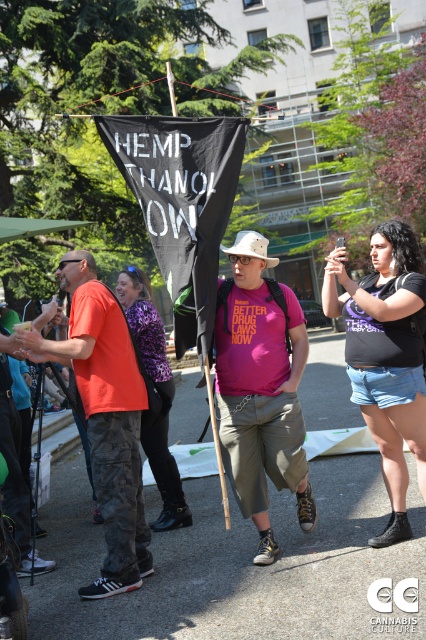
Question: Is orange t-shirt at center bigger than purple printed shirt at center?

Choices:
 (A) no
 (B) yes

Answer: (A)

Question: Which point is farther to the camera?

Choices:
 (A) (402, 381)
 (B) (264, 257)

Answer: (B)

Question: Can you confirm if pink matte t-shirt at center is positioned to the left of purple printed shirt at center?

Choices:
 (A) yes
 (B) no

Answer: (B)

Question: Is matte black t-shirt at center above purple printed shirt at center?

Choices:
 (A) yes
 (B) no

Answer: (A)

Question: Which object is the closest to the matte black t-shirt at center?

Choices:
 (A) pink matte t-shirt at center
 (B) purple printed shirt at center

Answer: (A)

Question: Which of the following is the closest to the observer?

Choices:
 (A) matte black t-shirt at center
 (B) pink matte t-shirt at center

Answer: (A)